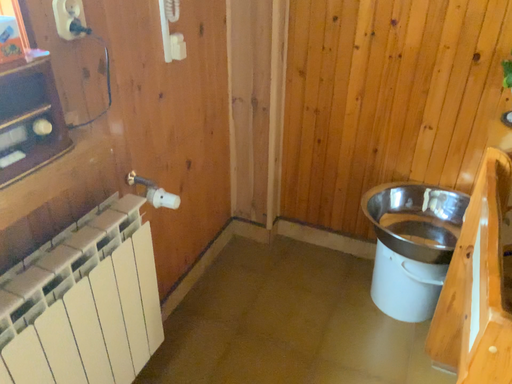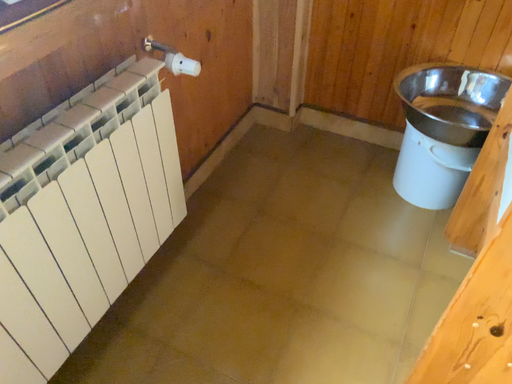
Question: Which way did the camera rotate in the video?

Choices:
 (A) rotated upward
 (B) rotated downward

Answer: (B)